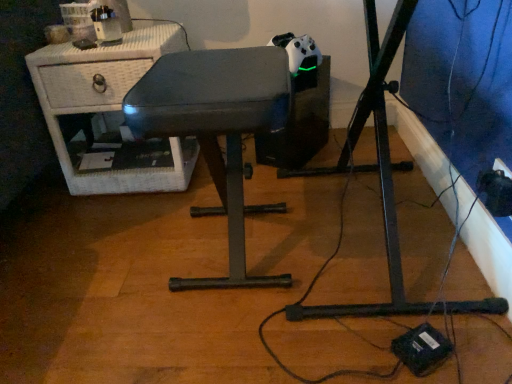
This screenshot has height=384, width=512. Find the location of `free space that is in between white wicker nightstand at upper left, the first furniture viewed from the back, and metallic gray stool at center, which is counted as the first furniture, starting from the front`. free space that is in between white wicker nightstand at upper left, the first furniture viewed from the back, and metallic gray stool at center, which is counted as the first furniture, starting from the front is located at coordinates (155, 218).